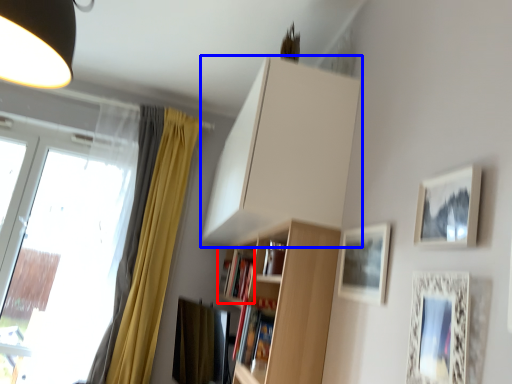
Question: Which of the following is the closest to the observer, book (highlighted by a red box) or cabinetry (highlighted by a blue box)?

Choices:
 (A) book
 (B) cabinetry

Answer: (B)